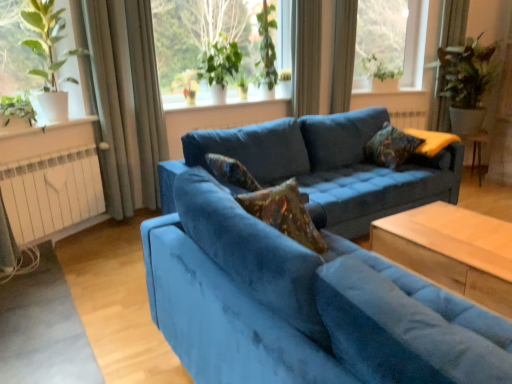
Question: Is transparent glass window at upper right, the first window from the right, bigger than green leafy plants at upper center, which is the 2th window in back-to-front order?

Choices:
 (A) no
 (B) yes

Answer: (A)

Question: Is transparent glass window at upper right, the 3th window viewed from the front, behind green leafy plants at upper center, which is the 2th window in back-to-front order?

Choices:
 (A) no
 (B) yes

Answer: (B)

Question: Does transparent glass window at upper right, the 3th window viewed from the front, come in front of green leafy plants at upper center, which is the 2th window from left to right?

Choices:
 (A) yes
 (B) no

Answer: (B)

Question: Can you confirm if transparent glass window at upper right, which appears as the 3th window when viewed from the left, is shorter than green leafy plants at upper center, which is the 2th window in back-to-front order?

Choices:
 (A) no
 (B) yes

Answer: (B)

Question: Is transparent glass window at upper right, which appears as the 3th window when viewed from the left, aimed at green leafy plants at upper center, the second window positioned from the right?

Choices:
 (A) yes
 (B) no

Answer: (B)

Question: From a real-world perspective, is velvet blue couch at center, acting as the second studio couch starting from the front, physically located above or below white metallic radiator at lower left?

Choices:
 (A) below
 (B) above

Answer: (B)

Question: Would you say velvet blue couch at center, acting as the second studio couch starting from the front, is to the left or to the right of white metallic radiator at lower left in the picture?

Choices:
 (A) left
 (B) right

Answer: (B)

Question: Considering their positions, is velvet blue couch at center, the first studio couch viewed from the back, located in front of or behind white metallic radiator at lower left?

Choices:
 (A) front
 (B) behind

Answer: (A)

Question: In terms of height, does velvet blue couch at center, acting as the second studio couch starting from the front, look taller or shorter compared to white metallic radiator at lower left?

Choices:
 (A) short
 (B) tall

Answer: (B)

Question: From the image's perspective, is gray fabric curtain at left, the 4th curtain when ordered from right to left, positioned above or below green leafy plant at left, the fifth plant positioned from the right?

Choices:
 (A) above
 (B) below

Answer: (A)

Question: Is point (114, 100) positioned closer to the camera than point (24, 99)?

Choices:
 (A) farther
 (B) closer

Answer: (A)

Question: From a real-world perspective, is gray fabric curtain at left, the 4th curtain when ordered from right to left, above or below green leafy plant at left, the first plant from the left?

Choices:
 (A) above
 (B) below

Answer: (B)

Question: Considering the positions of gray fabric curtain at left, which is counted as the first curtain, starting from the left, and green leafy plant at left, the first plant from the left, in the image, is gray fabric curtain at left, which is counted as the first curtain, starting from the left, wider or thinner than green leafy plant at left, the first plant from the left,?

Choices:
 (A) thin
 (B) wide

Answer: (A)

Question: Looking at the image, does green leafy plant at left, the first plant from the left, seem bigger or smaller compared to green leafy plant at upper center, the third plant from the left?

Choices:
 (A) big
 (B) small

Answer: (B)

Question: Is green leafy plant at left, the first plant from the left, inside or outside of green leafy plant at upper center, the third plant from the left?

Choices:
 (A) outside
 (B) inside

Answer: (A)